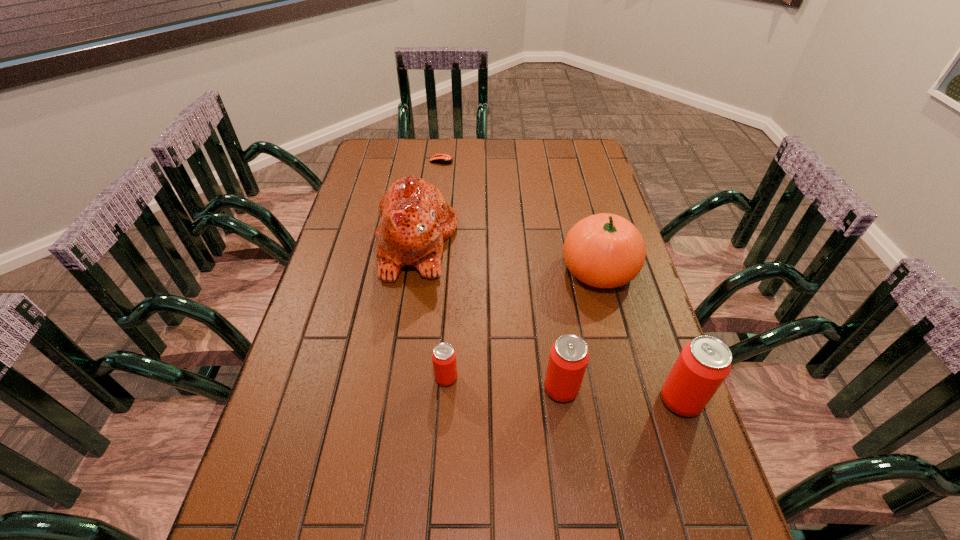
Please show where to add a beer can on the left while keeping spacing even. Please provide its 2D coordinates. Your answer should be formatted as a tuple, i.e. [(x, y)], where the tuple contains the x and y coordinates of a point satisfying the conditions above.

[(335, 367)]